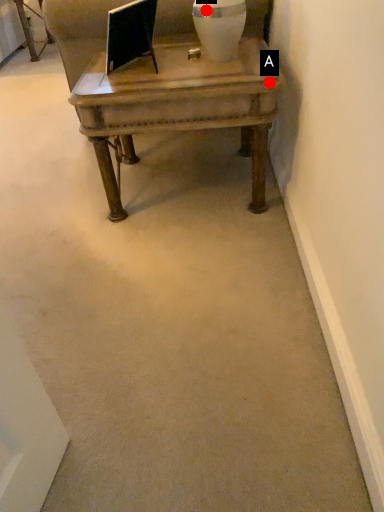
Question: Two points are circled on the image, labeled by A and B beside each circle. Which of the following is the farthest from the observer?

Choices:
 (A) A is further
 (B) B is further

Answer: (B)